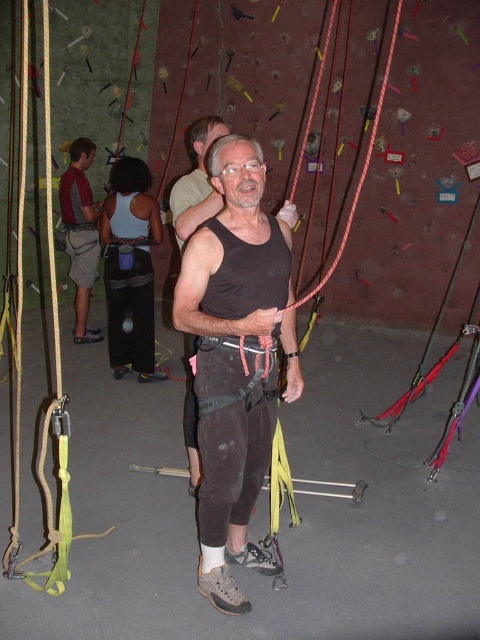
Question: Which point appears closest to the camera in this image?

Choices:
 (A) [213, 362]
 (B) [72, 278]

Answer: (A)

Question: Among these objects, which one is farthest from the camera?

Choices:
 (A) black matte tank top at center
 (B) brushed metal tank top at left

Answer: (B)

Question: Among these points, which one is nearest to the camera?

Choices:
 (A) (94, 262)
 (B) (201, 310)

Answer: (B)

Question: Is black matte tank top at center smaller than brushed metal tank top at left?

Choices:
 (A) no
 (B) yes

Answer: (B)

Question: Is black matte tank top at center further to the viewer compared to brushed metal tank top at left?

Choices:
 (A) yes
 (B) no

Answer: (B)

Question: Is black matte tank top at center below brushed metal tank top at left?

Choices:
 (A) no
 (B) yes

Answer: (B)